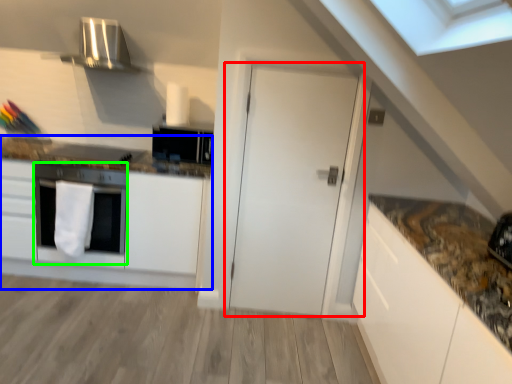
Question: Based on their relative distances, which object is nearer to door (highlighted by a red box)? Choose from cabinetry (highlighted by a blue box) and oven (highlighted by a green box).

Choices:
 (A) cabinetry
 (B) oven

Answer: (A)